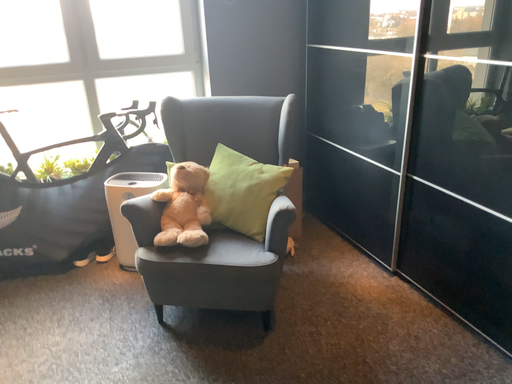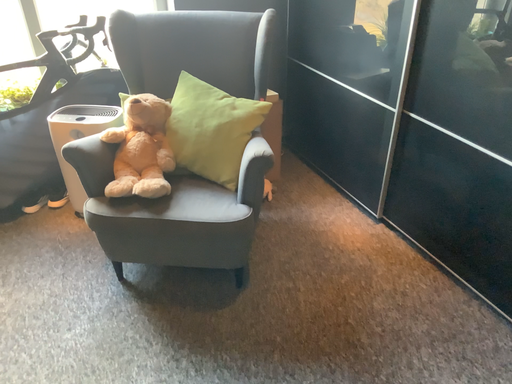
Question: How did the camera likely rotate when shooting the video?

Choices:
 (A) rotated upward
 (B) rotated downward

Answer: (B)